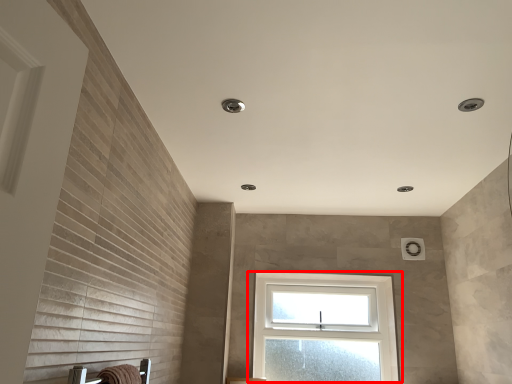
Question: Observing the image, what is the correct spatial positioning of window (annotated by the red box) in reference to bath towel?

Choices:
 (A) right
 (B) left

Answer: (A)